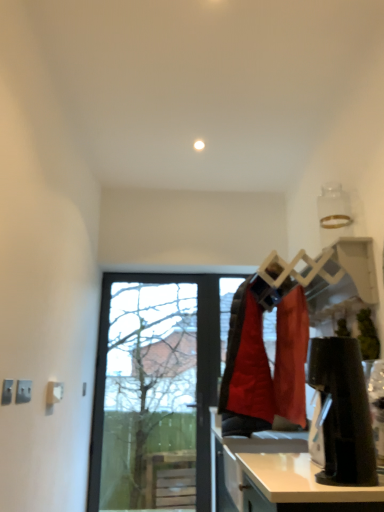
Question: Considering the relative sizes of light brown laminate counter top at lower right and transparent glass door at center in the image provided, is light brown laminate counter top at lower right taller than transparent glass door at center?

Choices:
 (A) no
 (B) yes

Answer: (A)

Question: From a real-world perspective, is light brown laminate counter top at lower right located beneath transparent glass door at center?

Choices:
 (A) yes
 (B) no

Answer: (A)

Question: Is light brown laminate counter top at lower right positioned beyond the bounds of transparent glass door at center?

Choices:
 (A) yes
 (B) no

Answer: (A)

Question: Could you tell me if light brown laminate counter top at lower right is facing transparent glass door at center?

Choices:
 (A) no
 (B) yes

Answer: (A)

Question: Could transparent glass door at center be considered to be inside light brown laminate counter top at lower right?

Choices:
 (A) no
 (B) yes

Answer: (A)

Question: From the image's perspective, is light brown laminate counter top at lower right below transparent glass door at center?

Choices:
 (A) yes
 (B) no

Answer: (A)

Question: Considering the relative sizes of transparent glass door at center and light brown laminate counter top at lower right in the image provided, is transparent glass door at center taller than light brown laminate counter top at lower right?

Choices:
 (A) no
 (B) yes

Answer: (B)

Question: Considering the relative positions of transparent glass door at center and light brown laminate counter top at lower right in the image provided, is transparent glass door at center to the right of light brown laminate counter top at lower right from the viewer's perspective?

Choices:
 (A) no
 (B) yes

Answer: (A)

Question: From a real-world perspective, is transparent glass door at center on light brown laminate counter top at lower right?

Choices:
 (A) yes
 (B) no

Answer: (A)

Question: Is transparent glass door at center further to the viewer compared to light brown laminate counter top at lower right?

Choices:
 (A) no
 (B) yes

Answer: (B)

Question: From the image's perspective, is transparent glass door at center beneath light brown laminate counter top at lower right?

Choices:
 (A) no
 (B) yes

Answer: (A)

Question: Is transparent glass door at center far away from light brown laminate counter top at lower right?

Choices:
 (A) yes
 (B) no

Answer: (A)

Question: Looking at their shapes, would you say transparent glass door at center is wider or thinner than light brown laminate counter top at lower right?

Choices:
 (A) wide
 (B) thin

Answer: (B)